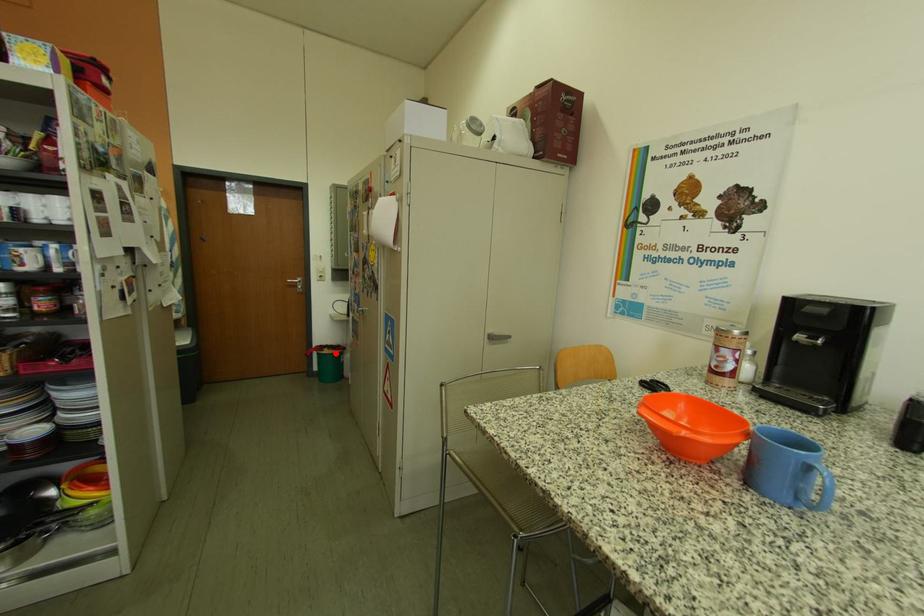
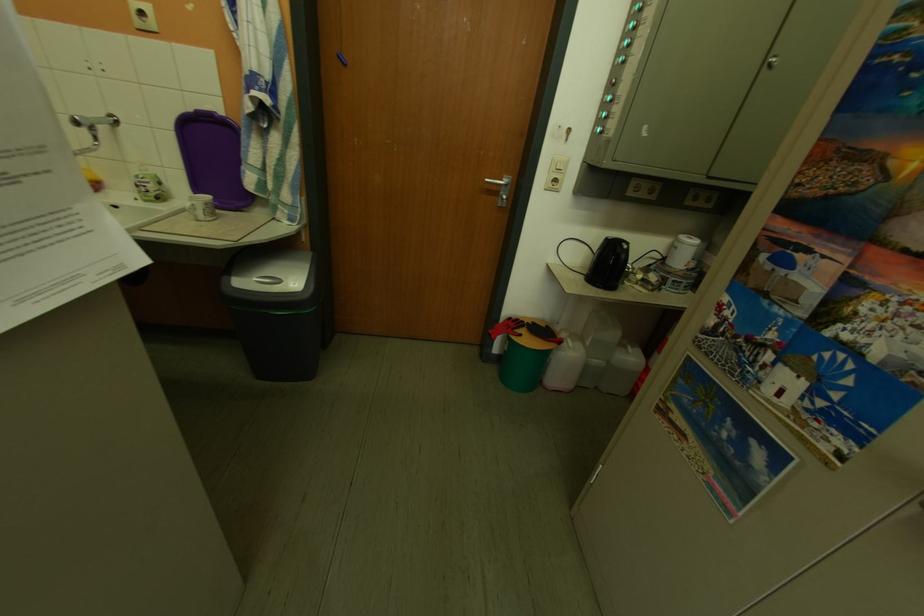
Locate, in the second image, the point that corresponds to the highlighted location in the first image.

(533, 338)